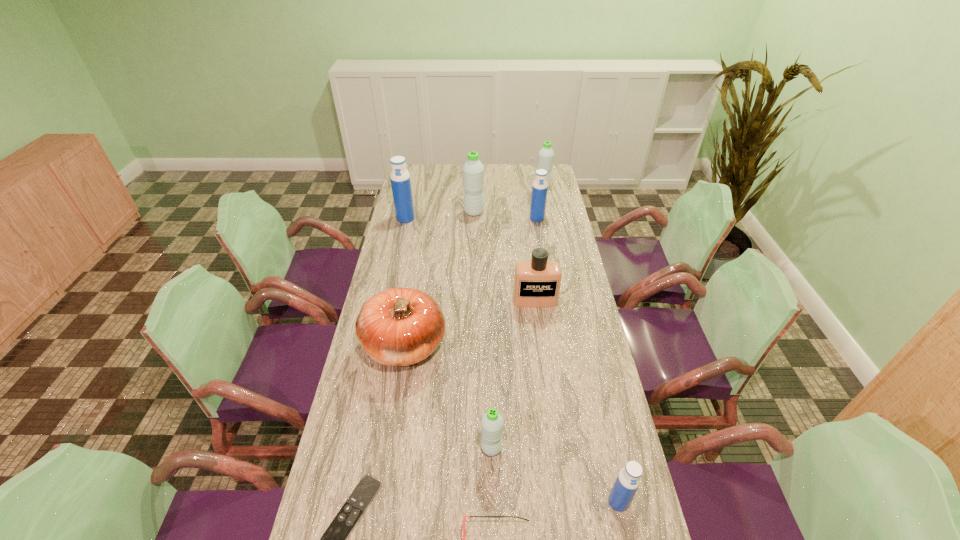
Locate which green water bottle ranks in proximity to the nearest green water bottle. Please provide its 2D coordinates. Your answer should be formatted as a tuple, i.e. [(x, y)], where the tuple contains the x and y coordinates of a point satisfying the conditions above.

[(473, 171)]

Select which green water bottle is the second closest to the biggest blue water bottle. Please provide its 2D coordinates. Your answer should be formatted as a tuple, i.e. [(x, y)], where the tuple contains the x and y coordinates of a point satisfying the conditions above.

[(546, 155)]

Point out which blue water bottle is positioned as the second nearest to the second blue water bottle from left to right. Please provide its 2D coordinates. Your answer should be formatted as a tuple, i.e. [(x, y)], where the tuple contains the x and y coordinates of a point satisfying the conditions above.

[(628, 480)]

You are a GUI agent. You are given a task and a screenshot of the screen. Output one action in this format:
    pyautogui.click(x=<x>, y=<y>)
    Task: Click on the blue water bottle that is the third closest one to the second nearest green water bottle
    The height and width of the screenshot is (540, 960).
    Given the screenshot: What is the action you would take?
    pyautogui.click(x=628, y=480)

Where is `blank area in the image that satisfies the following two spatial constraints: 1. on the front side of the fifth farthest water bottle; 2. on the right side of the pumpkin`? The image size is (960, 540). blank area in the image that satisfies the following two spatial constraints: 1. on the front side of the fifth farthest water bottle; 2. on the right side of the pumpkin is located at coordinates (388, 448).